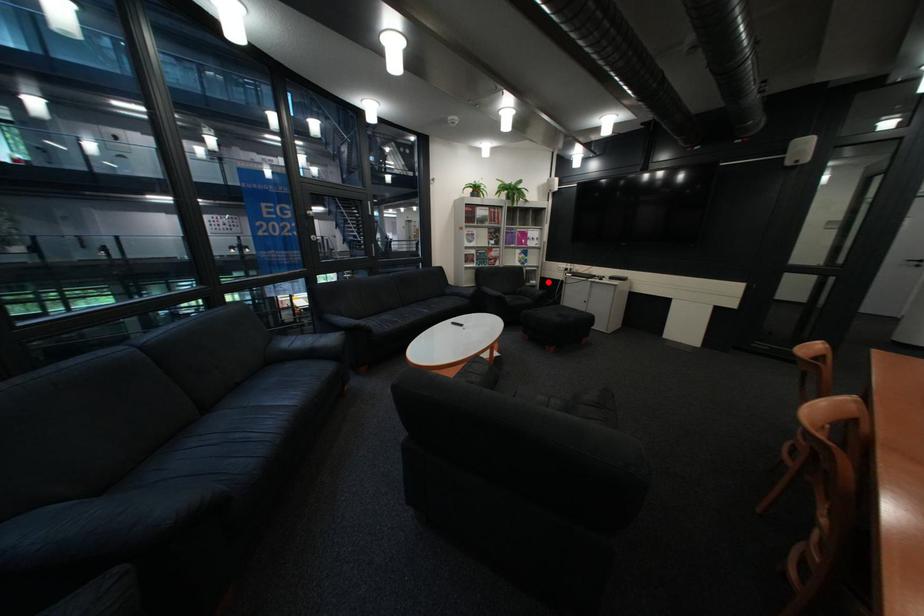
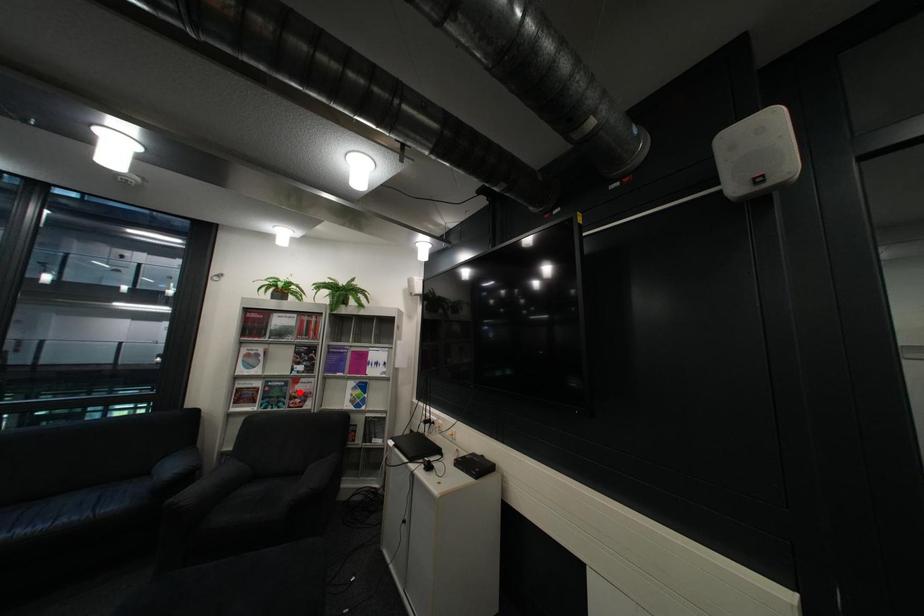
I am providing you with two images of the same scene from different viewpoints. A red point is marked on the first image and another point is marked on the second image. Are the points marked in image1 and image2 representing the same 3D position?

No